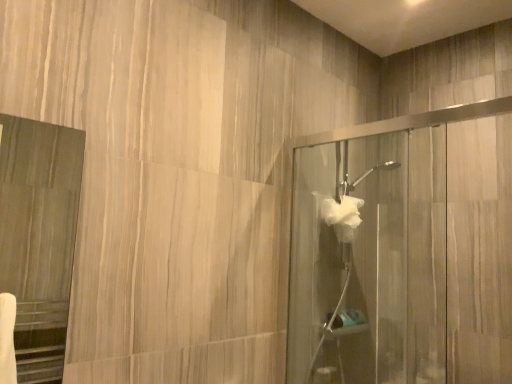
What do you see at coordinates (39, 237) in the screenshot? I see `matte wood mirror at left, the first screen door in the left-to-right sequence` at bounding box center [39, 237].

Where is `clear glass shower door at right, the 2th screen door positioned from the left`? This screenshot has height=384, width=512. clear glass shower door at right, the 2th screen door positioned from the left is located at coordinates (369, 260).

Measure the distance between clear glass shower door at right, which is the 1th screen door in back-to-front order, and camera.

A distance of 1.78 meters exists between clear glass shower door at right, which is the 1th screen door in back-to-front order, and camera.

Locate an element on the screen. This screenshot has height=384, width=512. matte wood mirror at left, placed as the second screen door when sorted from back to front is located at coordinates (39, 237).

Which is behind, matte wood mirror at left, which is the 1th screen door in front-to-back order, or white fluffy hand towel at center-right?

white fluffy hand towel at center-right is behind.

Considering the sizes of objects matte wood mirror at left, placed as the second screen door when sorted from back to front, and white fluffy hand towel at center-right in the image provided, who is taller, matte wood mirror at left, placed as the second screen door when sorted from back to front, or white fluffy hand towel at center-right?

With more height is matte wood mirror at left, placed as the second screen door when sorted from back to front.

From the picture: From the image's perspective, is matte wood mirror at left, placed as the second screen door when sorted from back to front, on top of white fluffy hand towel at center-right?

No, from the image's perspective, matte wood mirror at left, placed as the second screen door when sorted from back to front, is not on top of white fluffy hand towel at center-right.

What's the angular difference between matte wood mirror at left, which is the 1th screen door in front-to-back order, and white fluffy hand towel at center-right's facing directions?

There is a 1.54-degree angle between the facing directions of matte wood mirror at left, which is the 1th screen door in front-to-back order, and white fluffy hand towel at center-right.

Would you consider clear glass shower door at right, the 1th screen door in the right-to-left sequence, to be distant from white fluffy hand towel at center-right?

No, clear glass shower door at right, the 1th screen door in the right-to-left sequence, is not far from white fluffy hand towel at center-right.

From a real-world perspective, which is physically above, clear glass shower door at right, the 1th screen door in the right-to-left sequence, or white fluffy hand towel at center-right?

In real-world perspective, white fluffy hand towel at center-right is above.

Based on the photo, from the image's perspective, which one is positioned higher, clear glass shower door at right, which is the 1th screen door in back-to-front order, or white fluffy hand towel at center-right?

white fluffy hand towel at center-right, from the image's perspective.

Which object is further away from the camera, white fluffy hand towel at center-right or matte wood mirror at left, which is the 2th screen door from right to left?

Positioned behind is white fluffy hand towel at center-right.

Can you confirm if white fluffy hand towel at center-right is shorter than matte wood mirror at left, placed as the second screen door when sorted from back to front?

Indeed, white fluffy hand towel at center-right has a lesser height compared to matte wood mirror at left, placed as the second screen door when sorted from back to front.

Considering the relative positions of white fluffy hand towel at center-right and matte wood mirror at left, placed as the second screen door when sorted from back to front, in the image provided, is white fluffy hand towel at center-right to the left of matte wood mirror at left, placed as the second screen door when sorted from back to front, from the viewer's perspective?

Incorrect, white fluffy hand towel at center-right is not on the left side of matte wood mirror at left, placed as the second screen door when sorted from back to front.

Considering the relative sizes of white fluffy hand towel at center-right and matte wood mirror at left, which is the 1th screen door in front-to-back order, in the image provided, is white fluffy hand towel at center-right thinner than matte wood mirror at left, which is the 1th screen door in front-to-back order,?

Incorrect, the width of white fluffy hand towel at center-right is not less than that of matte wood mirror at left, which is the 1th screen door in front-to-back order.

From the picture: Who is smaller, matte wood mirror at left, placed as the second screen door when sorted from back to front, or clear glass shower door at right, which is the 1th screen door in back-to-front order?

With smaller size is matte wood mirror at left, placed as the second screen door when sorted from back to front.

Looking at their sizes, would you say matte wood mirror at left, which is the 2th screen door from right to left, is wider or thinner than clear glass shower door at right, the 1th screen door in the right-to-left sequence?

Considering their sizes, matte wood mirror at left, which is the 2th screen door from right to left, looks slimmer than clear glass shower door at right, the 1th screen door in the right-to-left sequence.

From the image's perspective, is matte wood mirror at left, the first screen door in the left-to-right sequence, above or below clear glass shower door at right, which is the 1th screen door in back-to-front order?

matte wood mirror at left, the first screen door in the left-to-right sequence, is situated higher than clear glass shower door at right, which is the 1th screen door in back-to-front order, in the image.

How different are the orientations of matte wood mirror at left, which is the 1th screen door in front-to-back order, and clear glass shower door at right, the 2th screen door positioned from the left, in degrees?

The angle between the facing direction of matte wood mirror at left, which is the 1th screen door in front-to-back order, and the facing direction of clear glass shower door at right, the 2th screen door positioned from the left, is 179 degrees.

From the image's perspective, is clear glass shower door at right, the 1th screen door in the right-to-left sequence, on matte wood mirror at left, which is the 1th screen door in front-to-back order?

No, from the image's perspective, clear glass shower door at right, the 1th screen door in the right-to-left sequence, is not on top of matte wood mirror at left, which is the 1th screen door in front-to-back order.

Is clear glass shower door at right, acting as the second screen door starting from the front, thinner than matte wood mirror at left, placed as the second screen door when sorted from back to front?

No, clear glass shower door at right, acting as the second screen door starting from the front, is not thinner than matte wood mirror at left, placed as the second screen door when sorted from back to front.

Is clear glass shower door at right, acting as the second screen door starting from the front, completely or partially inside white fluffy hand towel at center-right?

No, clear glass shower door at right, acting as the second screen door starting from the front, is not a part of white fluffy hand towel at center-right.

Looking at this image, can you tell me how much white fluffy hand towel at center-right and clear glass shower door at right, the 1th screen door in the right-to-left sequence, differ in facing direction?

There is a 179-degree angle between the facing directions of white fluffy hand towel at center-right and clear glass shower door at right, the 1th screen door in the right-to-left sequence.

Is white fluffy hand towel at center-right oriented away from clear glass shower door at right, which is the 1th screen door in back-to-front order?

That's right, white fluffy hand towel at center-right is facing away from clear glass shower door at right, which is the 1th screen door in back-to-front order.

Is white fluffy hand towel at center-right not near clear glass shower door at right, the 2th screen door positioned from the left?

They are positioned close to each other.

The image size is (512, 384). I want to click on hand towel above the matte wood mirror at left, the first screen door in the left-to-right sequence (from a real-world perspective), so click(342, 216).

Image resolution: width=512 pixels, height=384 pixels. I want to click on hand towel that is above the clear glass shower door at right, the 2th screen door positioned from the left (from the image's perspective), so click(x=342, y=216).

When comparing their distances from clear glass shower door at right, acting as the second screen door starting from the front, does white fluffy hand towel at center-right or matte wood mirror at left, which is the 2th screen door from right to left, seem closer?

white fluffy hand towel at center-right.

Looking at this image, based on their spatial positions, is white fluffy hand towel at center-right or clear glass shower door at right, acting as the second screen door starting from the front, closer to matte wood mirror at left, which is the 2th screen door from right to left?

clear glass shower door at right, acting as the second screen door starting from the front, is positioned closer to the anchor matte wood mirror at left, which is the 2th screen door from right to left.

Based on their spatial positions, is clear glass shower door at right, acting as the second screen door starting from the front, or matte wood mirror at left, placed as the second screen door when sorted from back to front, further from white fluffy hand towel at center-right?

Among the two, matte wood mirror at left, placed as the second screen door when sorted from back to front, is located further to white fluffy hand towel at center-right.

Based on their spatial positions, is clear glass shower door at right, the 1th screen door in the right-to-left sequence, or white fluffy hand towel at center-right closer to matte wood mirror at left, placed as the second screen door when sorted from back to front?

Based on the image, clear glass shower door at right, the 1th screen door in the right-to-left sequence, appears to be nearer to matte wood mirror at left, placed as the second screen door when sorted from back to front.

When comparing their distances from clear glass shower door at right, acting as the second screen door starting from the front, does matte wood mirror at left, which is the 1th screen door in front-to-back order, or white fluffy hand towel at center-right seem further?

Based on the image, matte wood mirror at left, which is the 1th screen door in front-to-back order, appears to be further to clear glass shower door at right, acting as the second screen door starting from the front.

Estimate the real-world distances between objects in this image. Which object is further from white fluffy hand towel at center-right, matte wood mirror at left, placed as the second screen door when sorted from back to front, or clear glass shower door at right, acting as the second screen door starting from the front?

matte wood mirror at left, placed as the second screen door when sorted from back to front, is further to white fluffy hand towel at center-right.

In order to click on hand towel between matte wood mirror at left, which is the 2th screen door from right to left, and clear glass shower door at right, which is the 1th screen door in back-to-front order in this screenshot , I will do click(x=342, y=216).